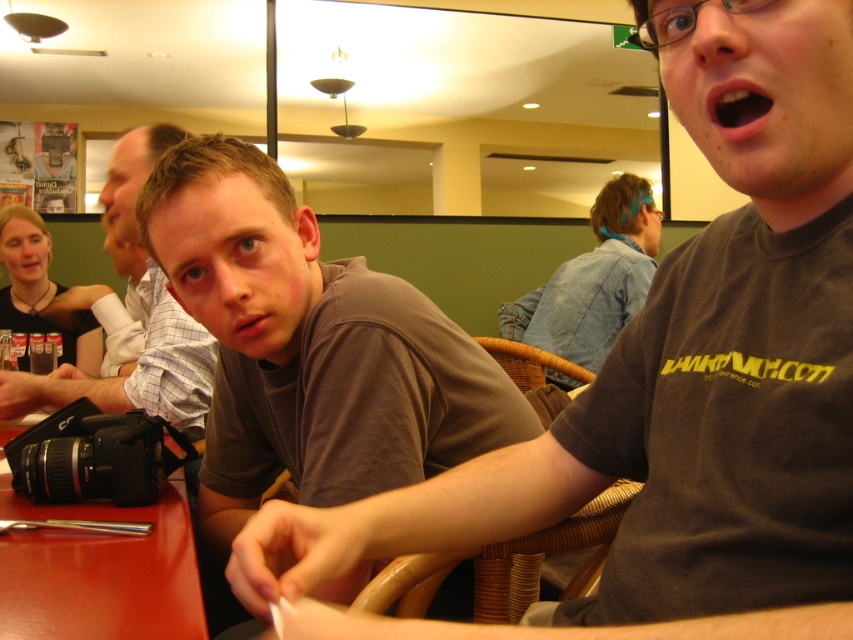
Question: Based on their relative distances, which object is nearer to the open skin at center?

Choices:
 (A) brown cotton shirt at center
 (B) pink matte lips at center

Answer: (A)

Question: Does matte gray shirt at center lie behind denim jacket at upper center?

Choices:
 (A) no
 (B) yes

Answer: (A)

Question: Considering the real-world distances, which object is closest to the brown matte shirt at center?

Choices:
 (A) brown cotton shirt at center
 (B) matte gray shirt at center
 (C) red plastic table at lower left
 (D) pink matte lips at center

Answer: (D)

Question: Which of these objects is positioned closest to the matte gray shirt at center?

Choices:
 (A) pink matte lips at center
 (B) red plastic table at lower left
 (C) brown matte shirt at center
 (D) open skin at center

Answer: (C)

Question: From the image, what is the correct spatial relationship of denim jacket at upper center in relation to pink matte lips at center?

Choices:
 (A) below
 (B) above

Answer: (B)

Question: Is brown cotton shirt at center in front of pink matte lips at center?

Choices:
 (A) yes
 (B) no

Answer: (A)